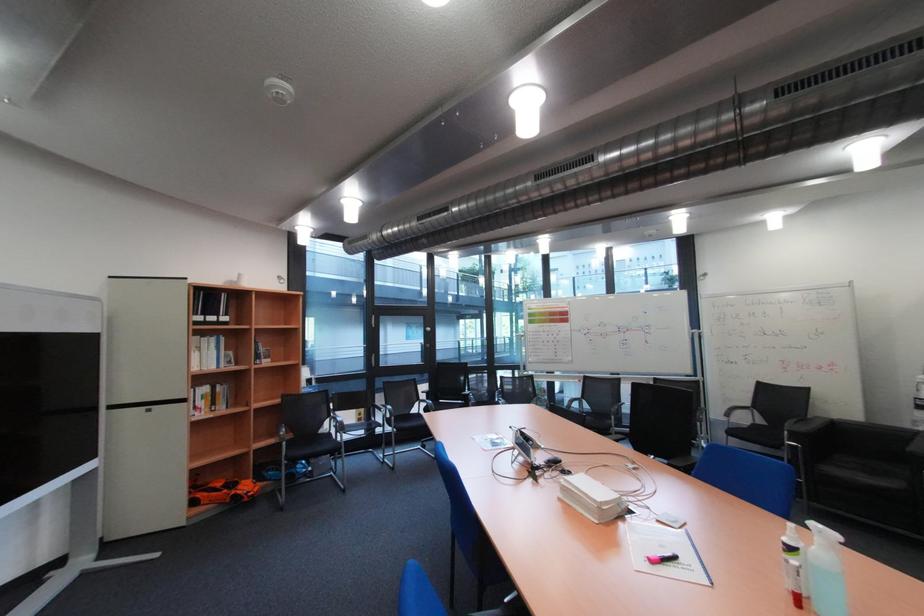
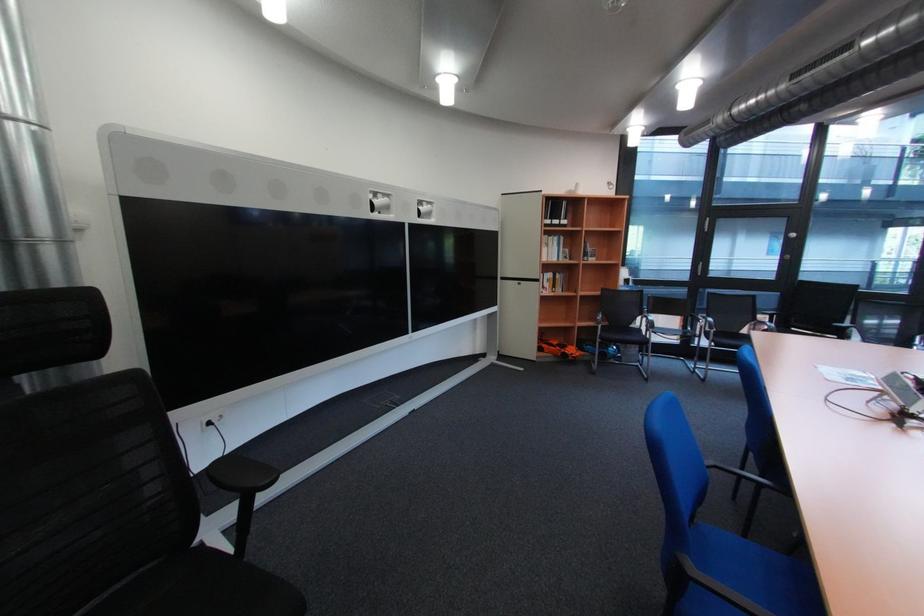
Question: The first image is from the beginning of the video and the second image is from the end. How did the camera likely rotate when shooting the video?

Choices:
 (A) Left
 (B) Right
 (C) Up
 (D) Down

Answer: (A)